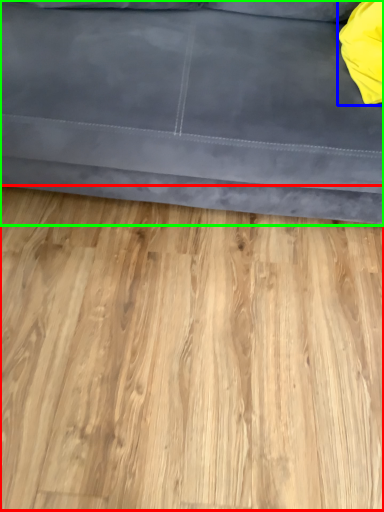
Question: Estimate the real-world distances between objects in this image. Which object is closer to hardwood (highlighted by a red box), pillow (highlighted by a blue box) or studio couch (highlighted by a green box)?

Choices:
 (A) pillow
 (B) studio couch

Answer: (B)